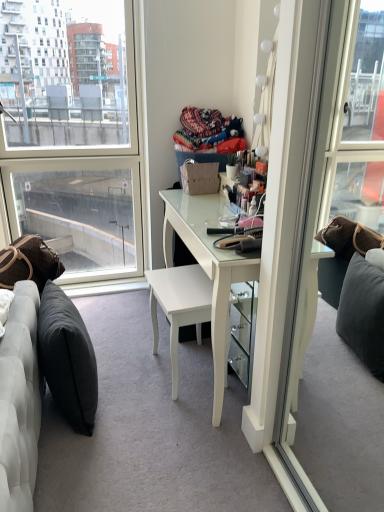
Find the location of `free point above white glossy chair at center (from a real-world perspective)`. free point above white glossy chair at center (from a real-world perspective) is located at coordinates (182, 280).